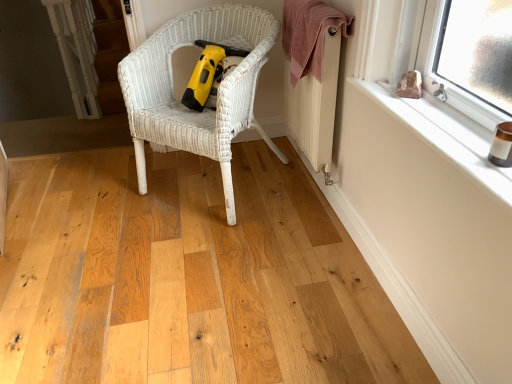
Locate an element on the screen. The width and height of the screenshot is (512, 384). free spot below white textured radiator at upper right (from a real-world perspective) is located at coordinates (303, 180).